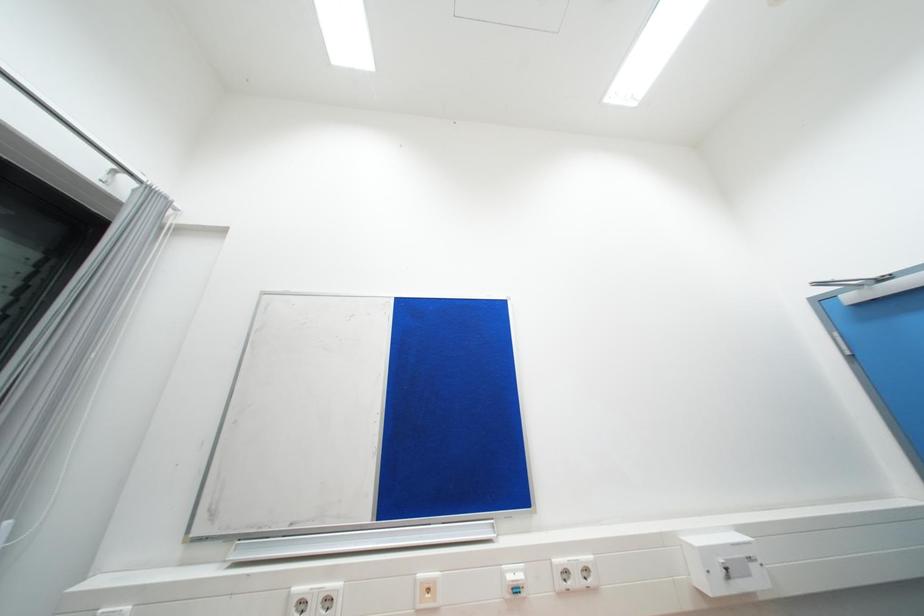
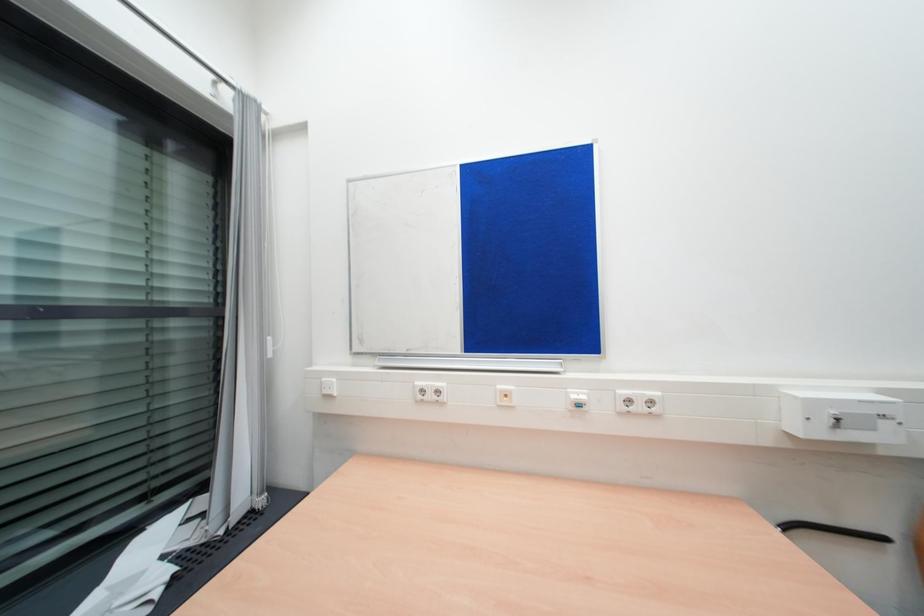
The images are taken continuously from a first-person perspective. In which direction are you moving?

The cameraman walked toward right, backward.